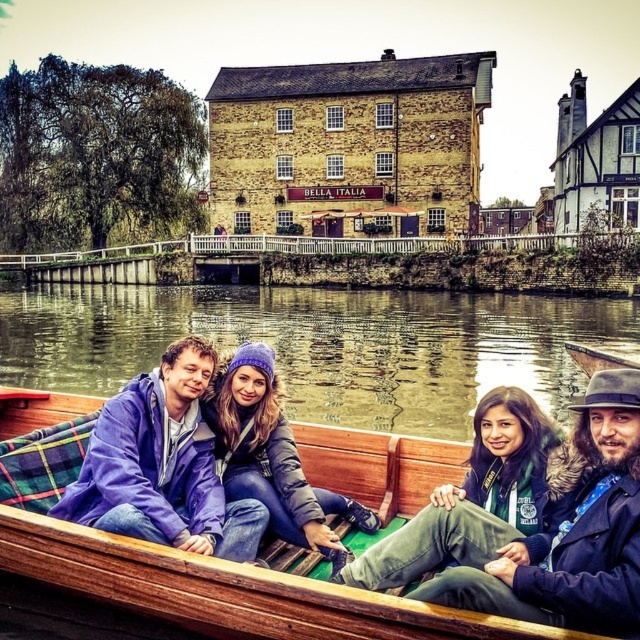
You are a photographer standing on the riverbank near the white railing. You want to take a photo of the matte purple beanie at center and the green matte jacket at lower right so that both are clearly visible in the frame. Given that your camera has a maximum focus range of 25 feet, will you be able to capture both subjects in focus?

The distance between the matte purple beane at center and the green matte jacket at lower right is 25.50 feet, which exceeds the camera focus range of 25 feet. Therefore, both subjects cannot be in focus simultaneously.

Based on the photo, you are a fashion designer observing the passengers on the boat. You need to determine which item is narrower between the matte purple beanie at center and the green matte jacket at lower right. Which one is it?

The matte purple beanie at center is thinner than the green matte jacket at lower right, so the matte purple beanie at center is narrower.